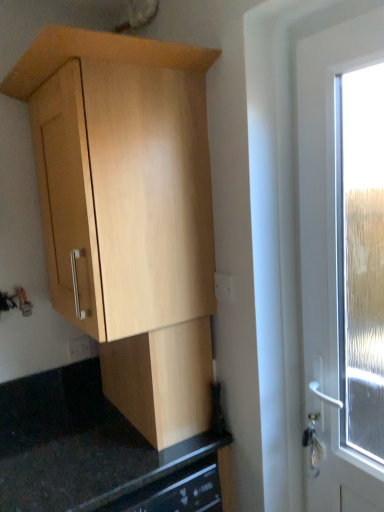
Question: Considering the positions of point (74, 354) and point (231, 288), is point (74, 354) closer or farther from the camera than point (231, 288)?

Choices:
 (A) closer
 (B) farther

Answer: (B)

Question: Considering the positions of white plastic electric outlet at lower left, which is the 1th electric outlet in back-to-front order, and white plastic electric outlet at center-right, the second electric outlet from the back, in the image, is white plastic electric outlet at lower left, which is the 1th electric outlet in back-to-front order, wider or thinner than white plastic electric outlet at center-right, the second electric outlet from the back,?

Choices:
 (A) thin
 (B) wide

Answer: (B)

Question: Which is farther from the light wood cabinet at upper left, which ranks as the 1th cabinetry in top-to-bottom order?

Choices:
 (A) light wood cabinet at center, the second cabinetry positioned from the top
 (B) white plastic electric outlet at lower left, which is the 1th electric outlet in back-to-front order
 (C) white plastic electric outlet at center-right, positioned as the 2th electric outlet in left-to-right order
 (D) black granite countertop at lower center

Answer: (B)

Question: Considering the real-world distances, which object is closest to the white plastic electric outlet at lower left, which is counted as the second electric outlet, starting from the top?

Choices:
 (A) black granite countertop at lower center
 (B) light wood cabinet at center, the second cabinetry positioned from the top
 (C) white plastic electric outlet at center-right, positioned as the 1th electric outlet in front-to-back order
 (D) light wood cabinet at upper left, marked as the 2th cabinetry in a bottom-to-top arrangement

Answer: (A)